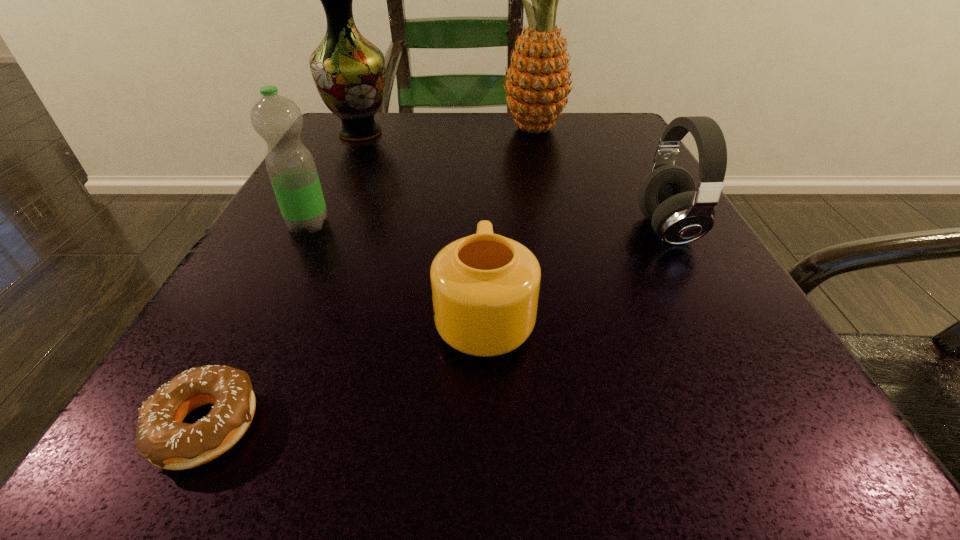
I want to click on vase located at the far edge, so click(x=349, y=72).

Image resolution: width=960 pixels, height=540 pixels. I want to click on object present at the near edge, so click(x=161, y=437).

The height and width of the screenshot is (540, 960). What are the coordinates of `vase positioned at the left edge` in the screenshot? It's located at (349, 72).

Locate an element on the screen. This screenshot has width=960, height=540. water bottle that is at the left edge is located at coordinates (278, 120).

Image resolution: width=960 pixels, height=540 pixels. What are the coordinates of `doughnut present at the left edge` in the screenshot? It's located at (161, 437).

Where is `pineapple present at the right edge`? Image resolution: width=960 pixels, height=540 pixels. pineapple present at the right edge is located at coordinates (537, 86).

This screenshot has width=960, height=540. I want to click on headset at the right edge, so click(x=680, y=215).

Identify the location of object situated at the far left corner. (349, 72).

I want to click on object at the near left corner, so click(161, 437).

Locate an element on the screen. object located in the far right corner section of the desktop is located at coordinates (537, 86).